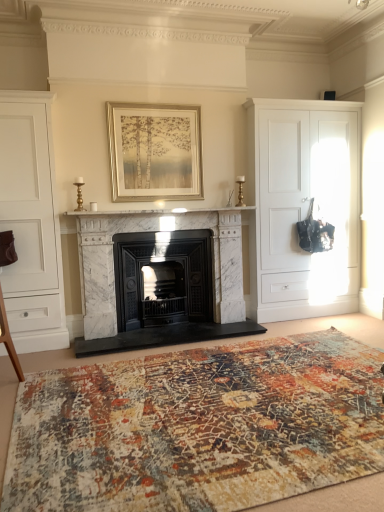
The image size is (384, 512). What do you see at coordinates (164, 264) in the screenshot? I see `white marble fireplace at center` at bounding box center [164, 264].

What is the approximate height of gold metallic picture frame at upper center?

gold metallic picture frame at upper center is 37.82 inches in height.

Identify the location of abstract patterned rug at center. (198, 426).

Identify the location of black cast iron wood burning stove at center. The width and height of the screenshot is (384, 512). (163, 278).

Is abstract patterned rug at center bigger than white marble fireplace at center?

Incorrect, abstract patterned rug at center is not larger than white marble fireplace at center.

From the image's perspective, is abstract patterned rug at center above or below white marble fireplace at center?

Based on their image positions, abstract patterned rug at center is located beneath white marble fireplace at center.

Relative to white marble fireplace at center, is abstract patterned rug at center in front or behind?

Visually, abstract patterned rug at center is located in front of white marble fireplace at center.

From the image's perspective, which object appears higher, white matte cabinet at left, which is counted as the 1th cabinetry, starting from the left, or white matte cabinet at right, which is counted as the 2th cabinetry, starting from the front?

white matte cabinet at right, which is counted as the 2th cabinetry, starting from the front, is shown above in the image.

Can you confirm if white matte cabinet at left, the 2th cabinetry when ordered from back to front, is smaller than white matte cabinet at right, which is counted as the 2th cabinetry, starting from the front?

Yes, white matte cabinet at left, the 2th cabinetry when ordered from back to front, is smaller than white matte cabinet at right, which is counted as the 2th cabinetry, starting from the front.

Is white matte cabinet at left, which is counted as the 1th cabinetry, starting from the left, looking in the opposite direction of white matte cabinet at right, the 1th cabinetry viewed from the right?

white matte cabinet at left, which is counted as the 1th cabinetry, starting from the left, does not have its back to white matte cabinet at right, the 1th cabinetry viewed from the right.

Does abstract patterned rug at center lie in front of white matte cabinet at left, which is counted as the 1th cabinetry, starting from the left?

Yes, abstract patterned rug at center is closer to the camera.

From the image's perspective, is abstract patterned rug at center located above white matte cabinet at left, the 2th cabinetry when ordered from back to front?

No, from the image's perspective, abstract patterned rug at center is not above white matte cabinet at left, the 2th cabinetry when ordered from back to front.

Is point (368, 428) less distant than point (21, 328)?

Yes, point (368, 428) is in front of point (21, 328).

Is white matte cabinet at left, the 2th cabinetry when ordered from back to front, bigger or smaller than abstract patterned rug at center?

white matte cabinet at left, the 2th cabinetry when ordered from back to front, is bigger than abstract patterned rug at center.

Could you measure the distance between white matte cabinet at left, which is counted as the 1th cabinetry, starting from the left, and abstract patterned rug at center?

white matte cabinet at left, which is counted as the 1th cabinetry, starting from the left, is 5.64 feet away from abstract patterned rug at center.

In terms of height, does white matte cabinet at left, which is counted as the 1th cabinetry, starting from the left, look taller or shorter compared to abstract patterned rug at center?

white matte cabinet at left, which is counted as the 1th cabinetry, starting from the left, is taller than abstract patterned rug at center.

This screenshot has height=512, width=384. Identify the location of mat in front of the white matte cabinet at left, the 2th cabinetry when ordered from back to front. (198, 426).

Based on the photo, considering the positions of objects gold metallic picture frame at upper center and abstract patterned rug at center in the image provided, who is in front, gold metallic picture frame at upper center or abstract patterned rug at center?

abstract patterned rug at center is closer to the camera.

What's the angular difference between gold metallic picture frame at upper center and abstract patterned rug at center's facing directions?

The angle between the facing direction of gold metallic picture frame at upper center and the facing direction of abstract patterned rug at center is 0.483 degrees.

Is gold metallic picture frame at upper center oriented towards abstract patterned rug at center?

No, gold metallic picture frame at upper center is not turned towards abstract patterned rug at center.

From the image's perspective, which object appears higher, gold metallic picture frame at upper center or abstract patterned rug at center?

From the image's view, gold metallic picture frame at upper center is above.

Is white marble fireplace at center positioned with its back to white matte cabinet at right, which is counted as the first cabinetry, starting from the back?

No, white matte cabinet at right, which is counted as the first cabinetry, starting from the back, is not at the back of white marble fireplace at center.

Who is shorter, white marble fireplace at center or white matte cabinet at right, which is counted as the 2th cabinetry, starting from the front?

white marble fireplace at center.

Considering the relative positions of white marble fireplace at center and white matte cabinet at right, the 1th cabinetry viewed from the right, in the image provided, is white marble fireplace at center to the right of white matte cabinet at right, the 1th cabinetry viewed from the right, from the viewer's perspective?

In fact, white marble fireplace at center is to the left of white matte cabinet at right, the 1th cabinetry viewed from the right.

Would you consider white matte cabinet at left, the 2th cabinetry when ordered from back to front, to be distant from white marble fireplace at center?

They are positioned close to each other.

Measure the distance from white matte cabinet at left, which is counted as the 1th cabinetry, starting from the left, to white marble fireplace at center.

They are 29.76 inches apart.

Considering the relative positions of white matte cabinet at left, positioned as the first cabinetry in front-to-back order, and white marble fireplace at center in the image provided, is white matte cabinet at left, positioned as the first cabinetry in front-to-back order, to the right of white marble fireplace at center from the viewer's perspective?

Incorrect, white matte cabinet at left, positioned as the first cabinetry in front-to-back order, is not on the right side of white marble fireplace at center.

Based on the photo, how many degrees apart are the facing directions of white matte cabinet at left, the 2th cabinetry when ordered from back to front, and white marble fireplace at center?

white matte cabinet at left, the 2th cabinetry when ordered from back to front, and white marble fireplace at center are facing 0.301 degrees away from each other.

Identify the location of fireplace that appears above the abstract patterned rug at center (from a real-world perspective). (164, 264).

Where is `cabinetry below the white matte cabinet at right, which is counted as the 2th cabinetry, starting from the front (from the image's perspective)`? cabinetry below the white matte cabinet at right, which is counted as the 2th cabinetry, starting from the front (from the image's perspective) is located at coordinates (31, 223).

Estimate the real-world distances between objects in this image. Which object is further from white marble fireplace at center, white matte cabinet at right, which is the second cabinetry from left to right, or white marble fireplace at center?

white matte cabinet at right, which is the second cabinetry from left to right, is further to white marble fireplace at center.

From the image, which object appears to be nearer to white matte cabinet at right, which is counted as the 2th cabinetry, starting from the front, abstract patterned rug at center or white marble fireplace at center?

The object closer to white matte cabinet at right, which is counted as the 2th cabinetry, starting from the front, is white marble fireplace at center.

Considering their positions, is abstract patterned rug at center positioned closer to black cast iron wood burning stove at center than white matte cabinet at right, the 1th cabinetry viewed from the right?

white matte cabinet at right, the 1th cabinetry viewed from the right, is closer to black cast iron wood burning stove at center.

When comparing their distances from black cast iron wood burning stove at center, does white marble fireplace at center or abstract patterned rug at center seem closer?

white marble fireplace at center.

From the image, which object appears to be farther from black cast iron wood burning stove at center, gold metallic picture frame at upper center or white matte cabinet at left, the 2th cabinetry when ordered from back to front?

white matte cabinet at left, the 2th cabinetry when ordered from back to front.

Based on their spatial positions, is abstract patterned rug at center or white marble fireplace at center further from white matte cabinet at left, the 2th cabinetry when ordered from back to front?

The object further to white matte cabinet at left, the 2th cabinetry when ordered from back to front, is abstract patterned rug at center.

Considering their positions, is white marble fireplace at center positioned closer to black cast iron wood burning stove at center than gold metallic picture frame at upper center?

Among the two, white marble fireplace at center is located nearer to black cast iron wood burning stove at center.

In the scene shown: Considering their positions, is white marble fireplace at center positioned closer to abstract patterned rug at center than white matte cabinet at left, the 2th cabinetry when ordered from back to front?

white matte cabinet at left, the 2th cabinetry when ordered from back to front, lies closer to abstract patterned rug at center than the other object.

The height and width of the screenshot is (512, 384). In order to click on picture frame between white matte cabinet at left, positioned as the first cabinetry in front-to-back order, and white marble fireplace at center in this screenshot , I will do `click(155, 152)`.

Identify the location of mantle situated between white matte cabinet at left, which is counted as the 1th cabinetry, starting from the left, and white matte cabinet at right, which is the second cabinetry from left to right, from left to right. This screenshot has height=512, width=384. (159, 212).

What are the coordinates of `fireplace between white matte cabinet at left, positioned as the first cabinetry in front-to-back order, and white matte cabinet at right, which is counted as the first cabinetry, starting from the back, from left to right` in the screenshot? It's located at (164, 264).

This screenshot has height=512, width=384. In order to click on picture frame positioned between abstract patterned rug at center and white matte cabinet at right, the 1th cabinetry viewed from the right, from near to far in this screenshot , I will do `click(155, 152)`.